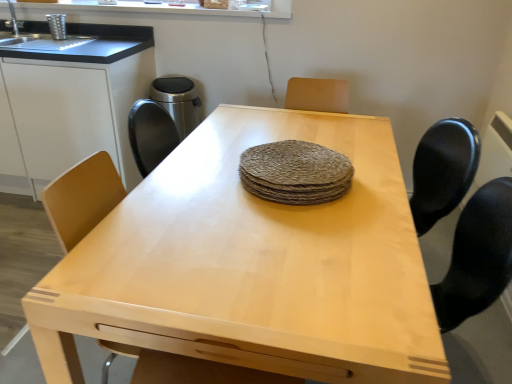
You are a GUI agent. You are given a task and a screenshot of the screen. Output one action in this format:
    pyautogui.click(x=<x>, y=<y>)
    Task: Click on the free spot to the left of rough woven placemat at center
    The image size is (512, 384).
    Given the screenshot: What is the action you would take?
    pyautogui.click(x=189, y=182)